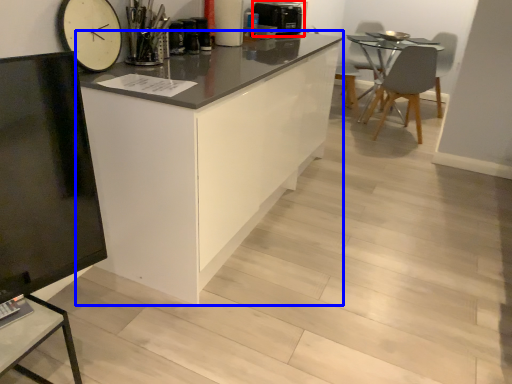
Question: Which object appears farthest to the camera in this image, appliance (highlighted by a red box) or cabinetry (highlighted by a blue box)?

Choices:
 (A) appliance
 (B) cabinetry

Answer: (A)